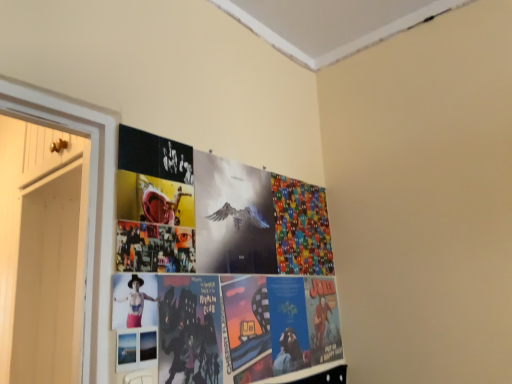
Question: Considering their positions, is metallic silver poster at center, marked as the first flyer in a left-to-right arrangement, located in front of or behind white wood door at left?

Choices:
 (A) front
 (B) behind

Answer: (A)

Question: From the image's perspective, is metallic silver poster at center, the second flyer when ordered from right to left, above or below white wood door at left?

Choices:
 (A) above
 (B) below

Answer: (A)

Question: Considering the real-world distances, which object is closest to the matte black person at center?

Choices:
 (A) white wood door at left
 (B) multicolored fabric at upper right, arranged as the 2th flyer when viewed from the left
 (C) metallic silver poster at center, which ranks as the second flyer in back-to-front order

Answer: (C)

Question: Estimate the real-world distances between objects in this image. Which object is closer to the matte black person at center?

Choices:
 (A) metallic silver poster at center, placed as the 1th flyer when sorted from front to back
 (B) white wood door at left
 (C) multicolored fabric at upper right, arranged as the 2th flyer when viewed from the left

Answer: (A)